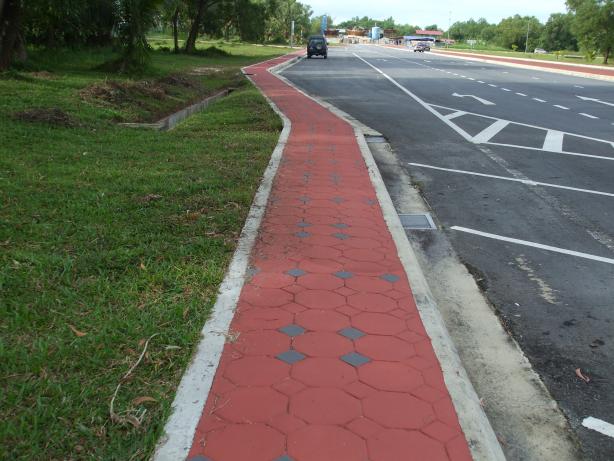
In order to click on gray tile in this screenshot , I will do `click(290, 353)`.